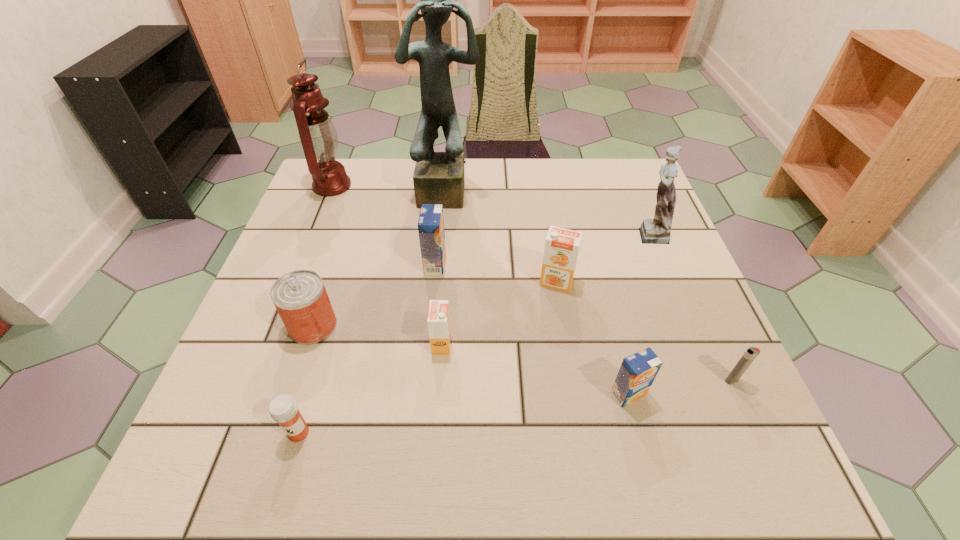
The width and height of the screenshot is (960, 540). I want to click on oil lamp that is at the far edge, so click(318, 136).

Locate an element on the screen. object that is positioned at the near edge is located at coordinates (283, 408).

Image resolution: width=960 pixels, height=540 pixels. What are the coordinates of `oil lamp that is at the left edge` in the screenshot? It's located at (318, 136).

At what (x,y) coordinates should I click in order to perform the action: click on can located in the left edge section of the desktop. Please return your answer as a coordinate pair (x, y). This screenshot has width=960, height=540. Looking at the image, I should click on (300, 297).

This screenshot has height=540, width=960. In order to click on medicine at the left edge in this screenshot , I will do `click(283, 408)`.

You are a GUI agent. You are given a task and a screenshot of the screen. Output one action in this format:
    pyautogui.click(x=<x>, y=<y>)
    Task: Click on the figurine situated at the right edge
    
    Given the screenshot: What is the action you would take?
    pyautogui.click(x=658, y=230)

This screenshot has width=960, height=540. In order to click on igniter that is at the right edge in this screenshot , I will do `click(751, 353)`.

Where is `object that is at the far left corner`? The width and height of the screenshot is (960, 540). object that is at the far left corner is located at coordinates (318, 136).

Find the location of a particular element. object located at the near left corner is located at coordinates (283, 408).

Find the location of a particular element. The image size is (960, 540). vacant area at the far edge of the desktop is located at coordinates (512, 170).